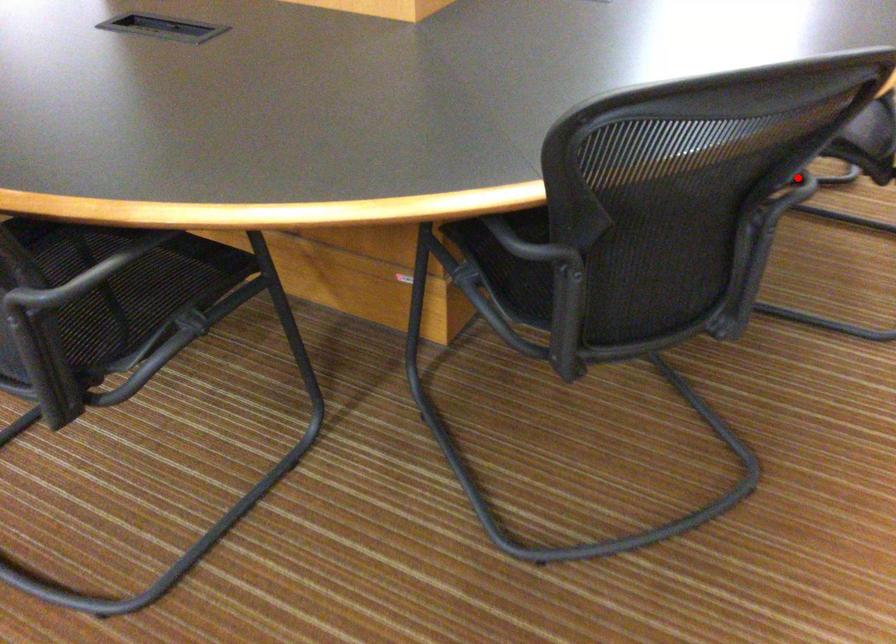
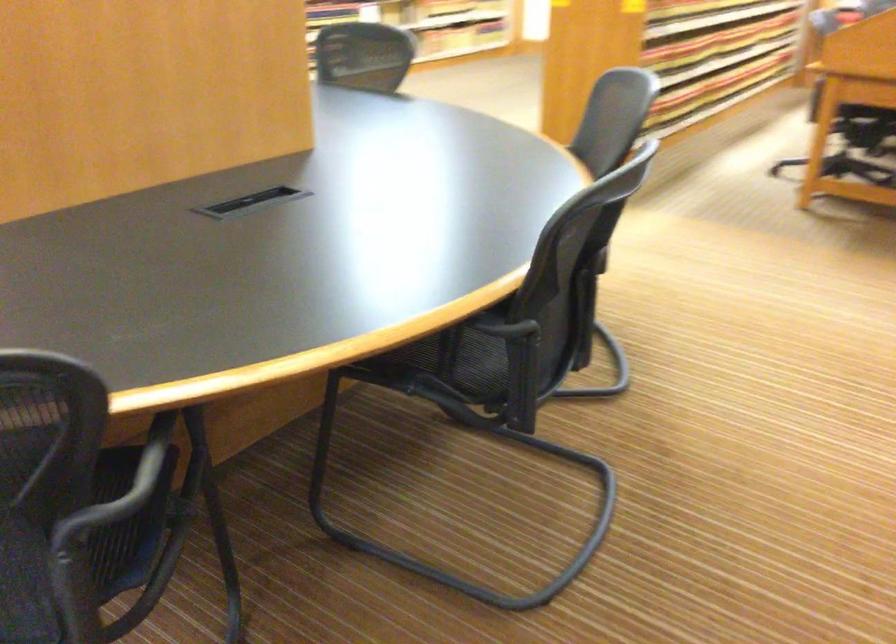
Find the pixel in the second image that matches the highlighted location in the first image.

(151, 460)